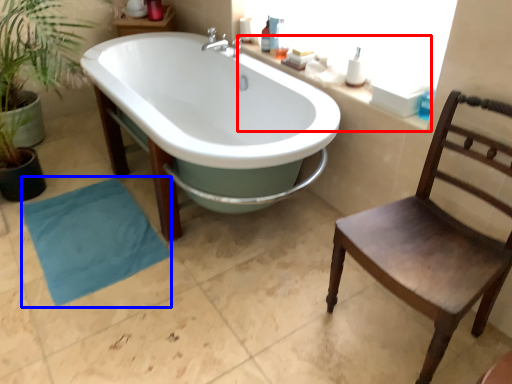
Question: Which object is further to the camera taking this photo, counter top (highlighted by a red box) or beach towel (highlighted by a blue box)?

Choices:
 (A) counter top
 (B) beach towel

Answer: (B)